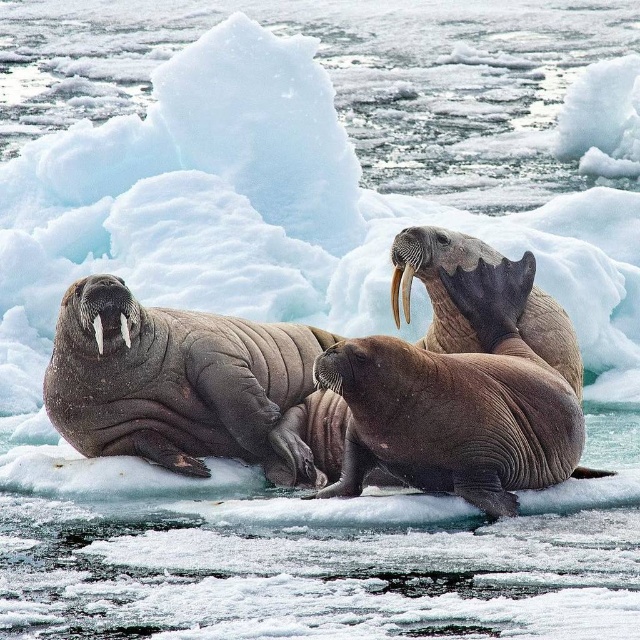
You are a wildlife photographer standing on a boat 30 feet away from the ice patch. You want to take a closeup photo of the white ivory tusk at center. Can you reach it with your telephoto lens that has a minimum focusing distance of 30 feet?

The white ivory tusk at center is 34.69 feet away from the viewer. Since your telephoto lens can focus as close as 30 feet, you can successfully capture the tusk as the distance is within the lens range.

You are a wildlife photographer aiming to capture a closeup of the white ivory tusk at center and the white matte tusk at left. Since you want to focus on both tusks in the same frame, which tusk should you position closer to the camera to ensure both are in focus?

The white ivory tusk at center is positioned on the right side of white matte tusk at left. To ensure both are in focus, position the camera so that both tusks are at a similar distance from the lens. Alternatively, use a smaller aperture for a deeper depth of field.